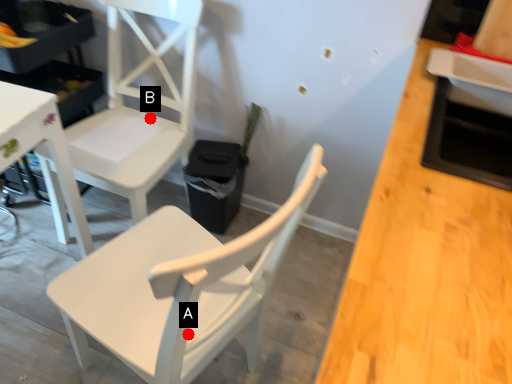
Question: Two points are circled on the image, labeled by A and B beside each circle. Which point is further to the camera?

Choices:
 (A) A is further
 (B) B is further

Answer: (B)